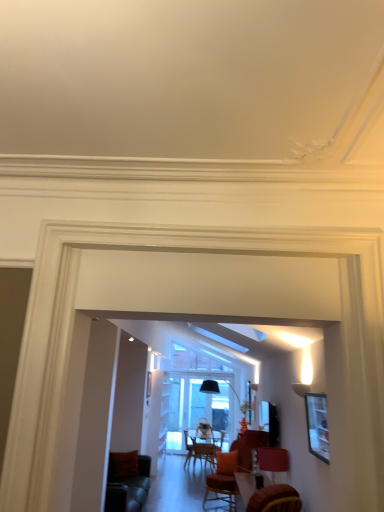
Question: Is matte red lampshade at lower right wider or thinner than matte black picture frame at right?

Choices:
 (A) thin
 (B) wide

Answer: (B)

Question: From the image's perspective, relative to matte black picture frame at right, is matte red lampshade at lower right above or below?

Choices:
 (A) above
 (B) below

Answer: (B)

Question: Based on their sizes in the image, would you say matte red lampshade at lower right is bigger or smaller than matte black picture frame at right?

Choices:
 (A) big
 (B) small

Answer: (A)

Question: Is matte black picture frame at right taller or shorter than matte red lampshade at lower right?

Choices:
 (A) short
 (B) tall

Answer: (B)

Question: Looking at the image, does matte black picture frame at right seem bigger or smaller compared to matte red lampshade at lower right?

Choices:
 (A) big
 (B) small

Answer: (B)

Question: Looking at their shapes, would you say matte black picture frame at right is wider or thinner than matte red lampshade at lower right?

Choices:
 (A) thin
 (B) wide

Answer: (A)

Question: Relative to matte red lampshade at lower right, is matte black picture frame at right in front or behind?

Choices:
 (A) front
 (B) behind

Answer: (A)